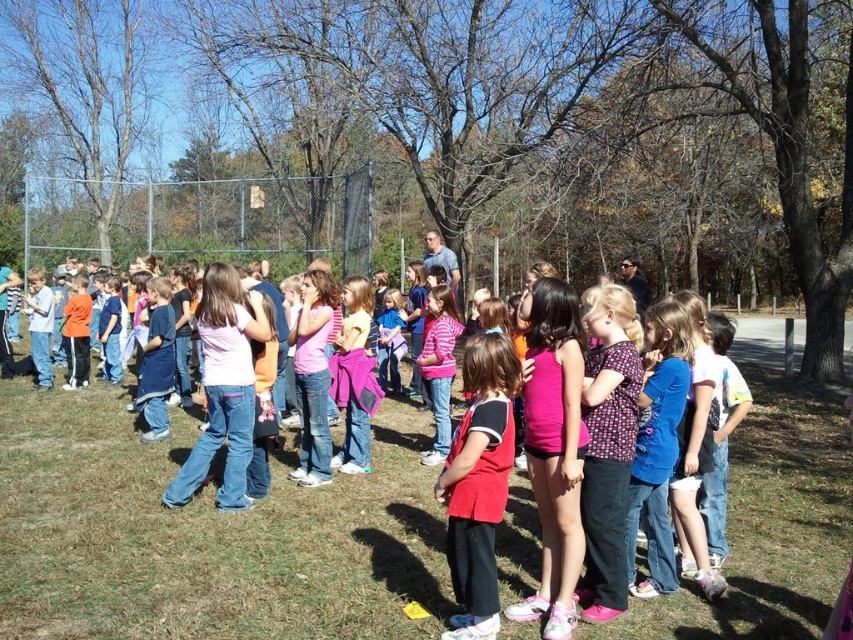
What are the coordinates of `red matte shirt at center` in the screenshot? It's located at point(479,483).

Is point (474, 477) positioned behind point (660, 346)?

No, it is in front of (660, 346).

I want to click on red matte shirt at center, so click(479, 483).